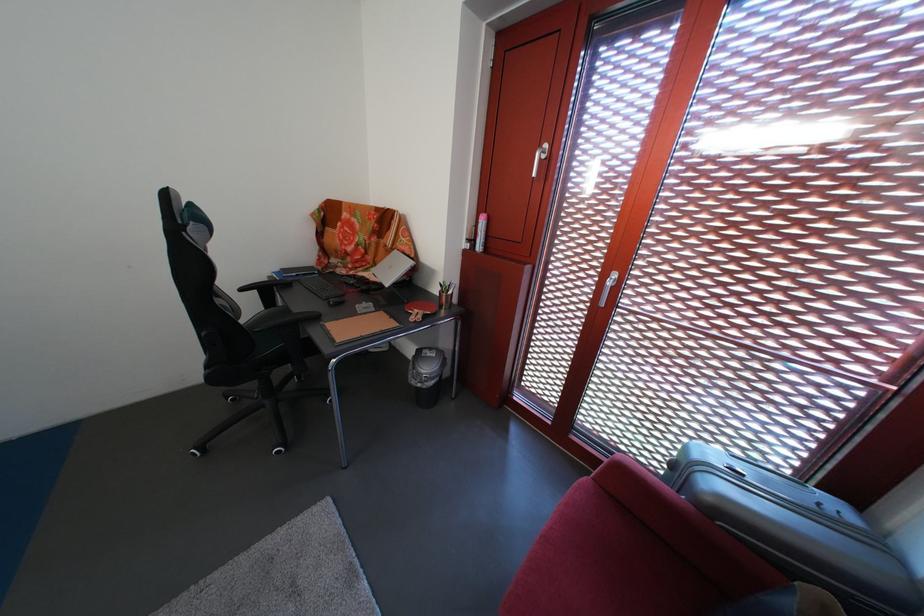
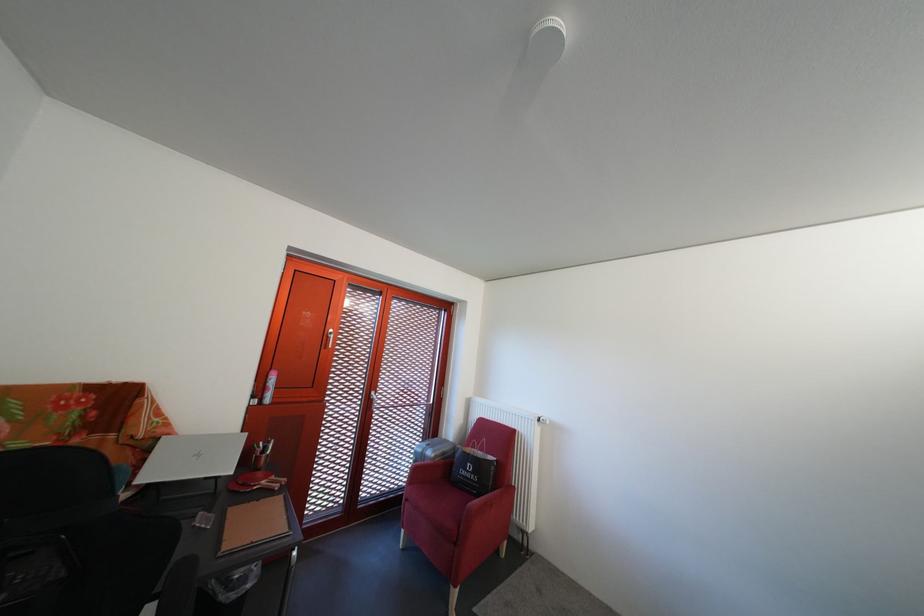
In the second image, find the point that corresponds to (x=479, y=246) in the first image.

(263, 403)